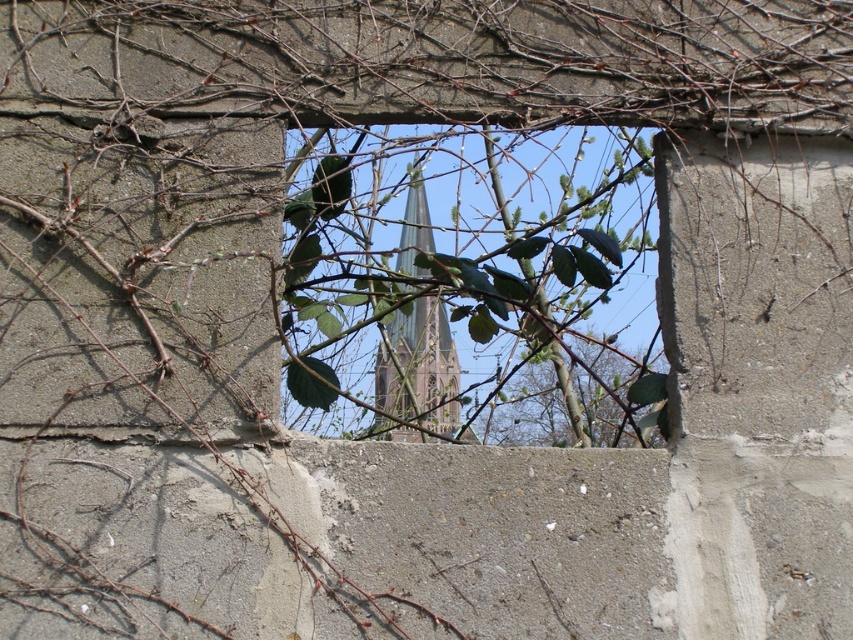
Question: Which point appears closest to the camera in this image?

Choices:
 (A) (440, 301)
 (B) (628, 435)

Answer: (A)

Question: Can you confirm if green leafy branch at center is thinner than green glass tower at center?

Choices:
 (A) yes
 (B) no

Answer: (B)

Question: Does green leafy branches at center appear on the right side of green glass tower at center?

Choices:
 (A) yes
 (B) no

Answer: (A)

Question: Which of the following is the closest to the observer?

Choices:
 (A) green leafy branches at center
 (B) green leafy branch at center

Answer: (A)

Question: Based on their relative distances, which object is nearer to the green leafy branches at center?

Choices:
 (A) green leafy branch at center
 (B) green glass tower at center

Answer: (B)

Question: Can you confirm if green leafy branches at center is bigger than green glass tower at center?

Choices:
 (A) no
 (B) yes

Answer: (B)